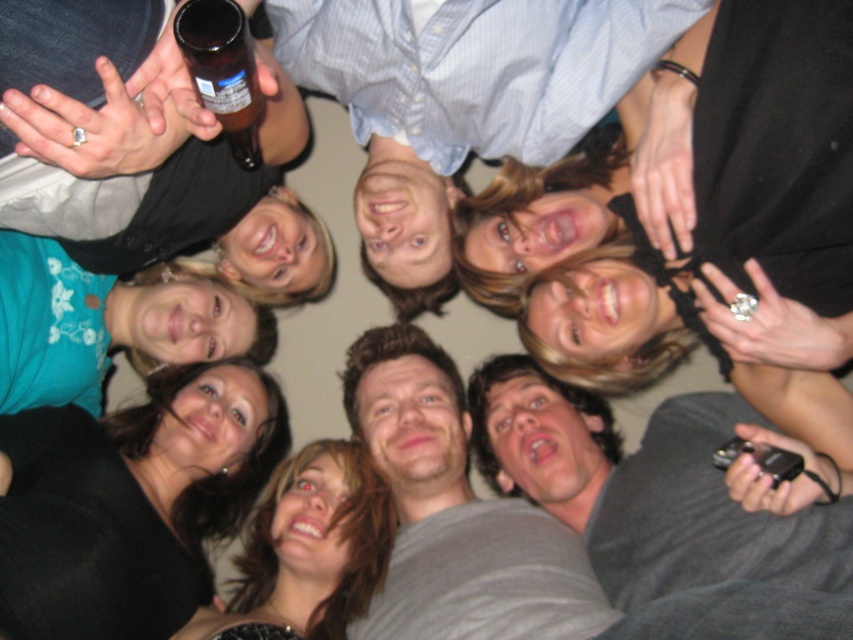
Question: Can you confirm if matte black bottle at upper left is positioned below gray fabric shirt at lower right?

Choices:
 (A) no
 (B) yes

Answer: (A)

Question: Is black matte shirt at lower left smaller than teal fabric shirt at lower left?

Choices:
 (A) no
 (B) yes

Answer: (A)

Question: Among these points, which one is farthest from the camera?

Choices:
 (A) (77, 252)
 (B) (625, 608)

Answer: (B)

Question: Which of the following is the closest to the observer?

Choices:
 (A) matte black bottle at upper left
 (B) gray cotton shirt at center
 (C) blonde hair at center

Answer: (A)

Question: Which point is farther to the camera?

Choices:
 (A) brown glass bottle at upper left
 (B) teal fabric shirt at lower left
 (C) gray fabric shirt at lower right
 (D) gray cotton shirt at center

Answer: (B)

Question: Does matte black bottle at upper left appear on the left side of gray fabric shirt at lower right?

Choices:
 (A) yes
 (B) no

Answer: (A)